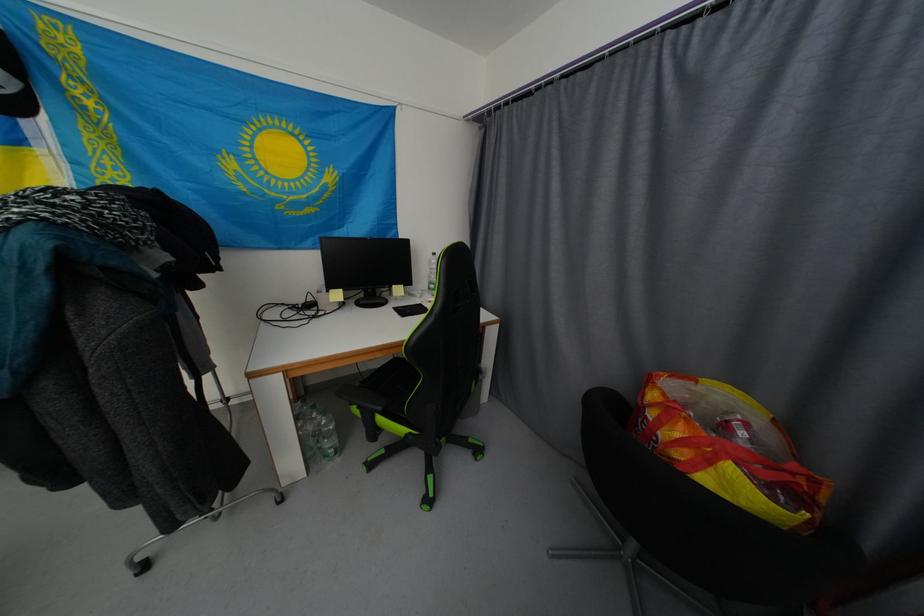
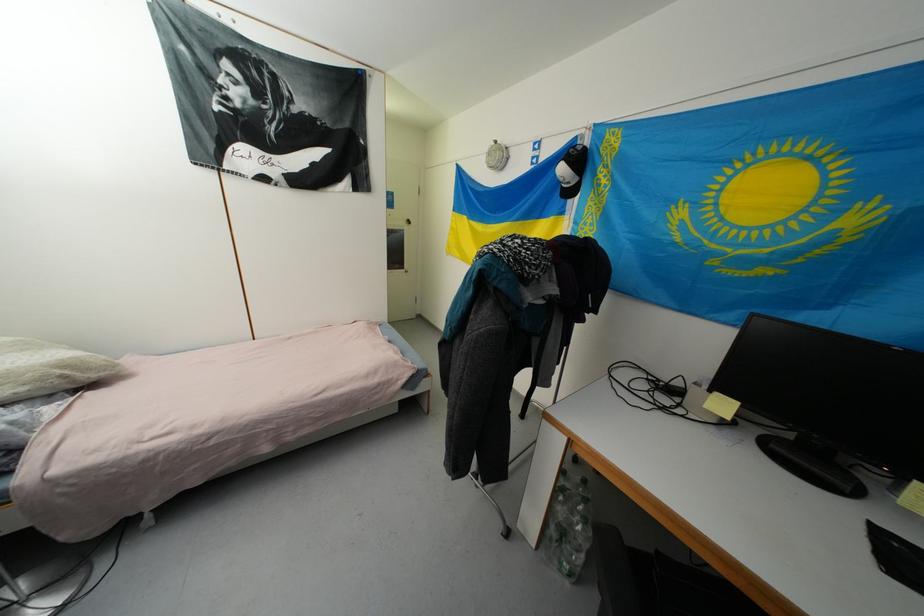
Question: The first image is from the beginning of the video and the second image is from the end. How did the camera likely rotate when shooting the video?

Choices:
 (A) Left
 (B) Right
 (C) Up
 (D) Down

Answer: (A)